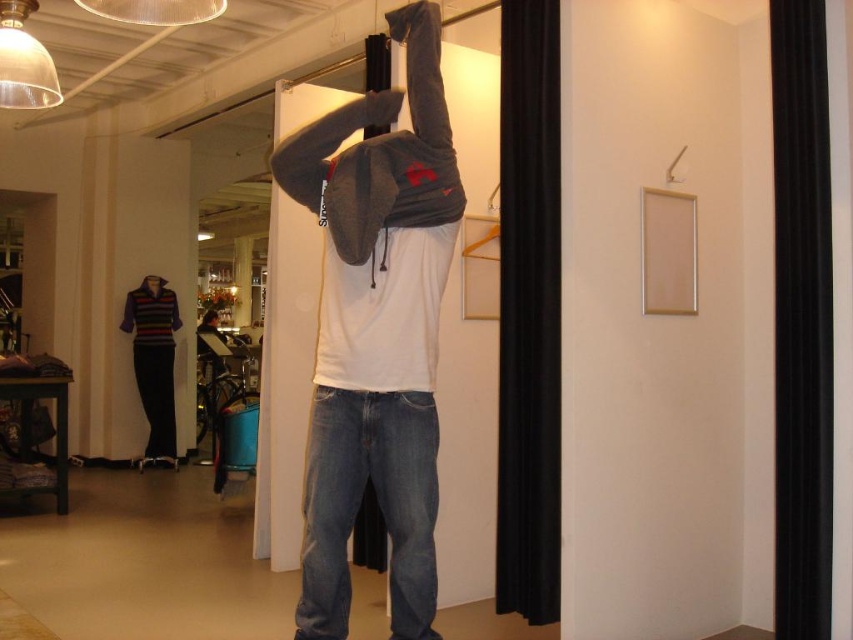
You are a customer in the store and want to try on the matte gray hoodie at center. The wooden hanger at upper center has a tag with size information. Can you reach both items at the same time while standing on the spot?

The distance between the matte gray hoodie at center and the wooden hanger at upper center is 4.87 feet. Since 4.87 feet is approximately 58.44 inches, it is unlikely that you can reach both items simultaneously while standing in one place without moving.

You are a customer in the store and want to take the matte gray hoodie at center from its position relative to the wooden hanger at upper center. Which direction should you move to reach it?

The matte gray hoodie at center is to the left of the wooden hanger at upper center, so you should move to the left to reach it.

You are a store employee who needs to hang the matte gray hoodie at center on the wooden hanger at upper center. Based on their sizes, will the hoodie fit on the hanger without overlapping the edges?

The matte gray hoodie at center is wider than the wooden hanger at upper center, so it will overlap the edges when hung.